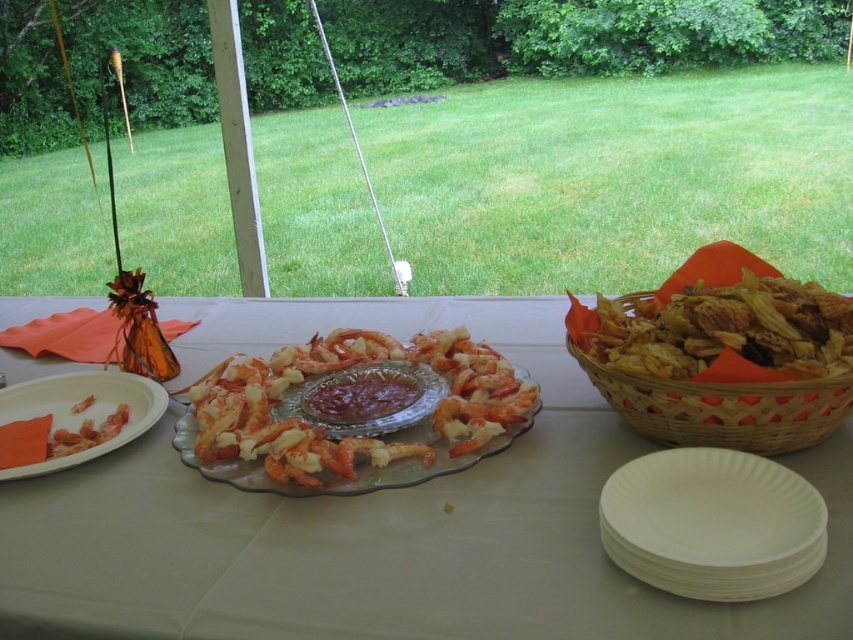
Question: Which point is farther to the camera?

Choices:
 (A) woven brown basket at right
 (B) white paper plate at left
 (C) translucent glass platter at center

Answer: (C)

Question: Which object is closer to the camera taking this photo?

Choices:
 (A) white paper plate at left
 (B) translucent glass plate at center
 (C) woven brown basket at right

Answer: (B)

Question: Is white paper plates at lower right closer to the viewer compared to woven brown basket at right?

Choices:
 (A) yes
 (B) no

Answer: (A)

Question: Can you confirm if translucent glass plate at center is positioned above shiny red sauce at center?

Choices:
 (A) no
 (B) yes

Answer: (B)

Question: Which object is farther from the camera taking this photo?

Choices:
 (A) white paper plate at left
 (B) white paper plates at lower right

Answer: (A)

Question: Is white paper plates at lower right behind woven brown basket at right?

Choices:
 (A) yes
 (B) no

Answer: (B)